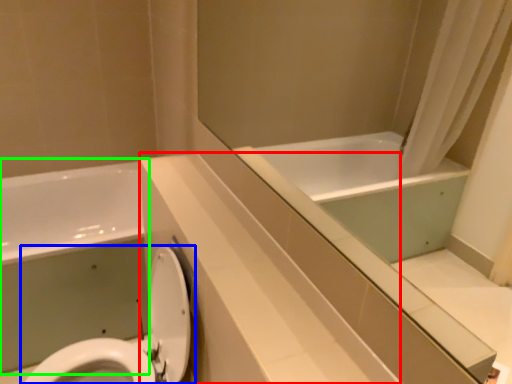
Question: Based on their relative distances, which object is farther from counter top (highlighted by a red box)? Choose from toilet (highlighted by a blue box) and bath (highlighted by a green box).

Choices:
 (A) toilet
 (B) bath

Answer: (B)